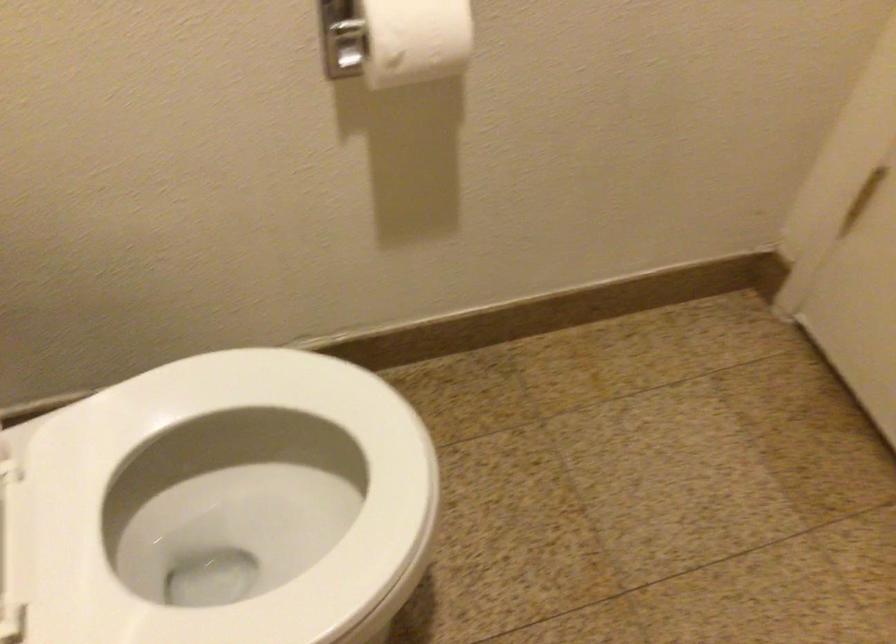
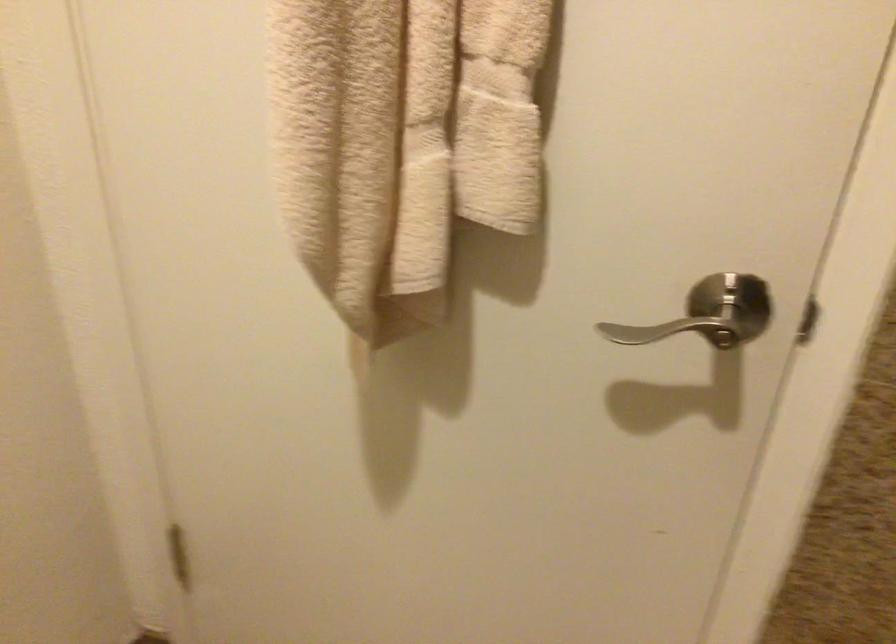
Question: The first image is from the beginning of the video and the second image is from the end. How did the camera likely rotate when shooting the video?

Choices:
 (A) Left
 (B) Right
 (C) Up
 (D) Down

Answer: (B)